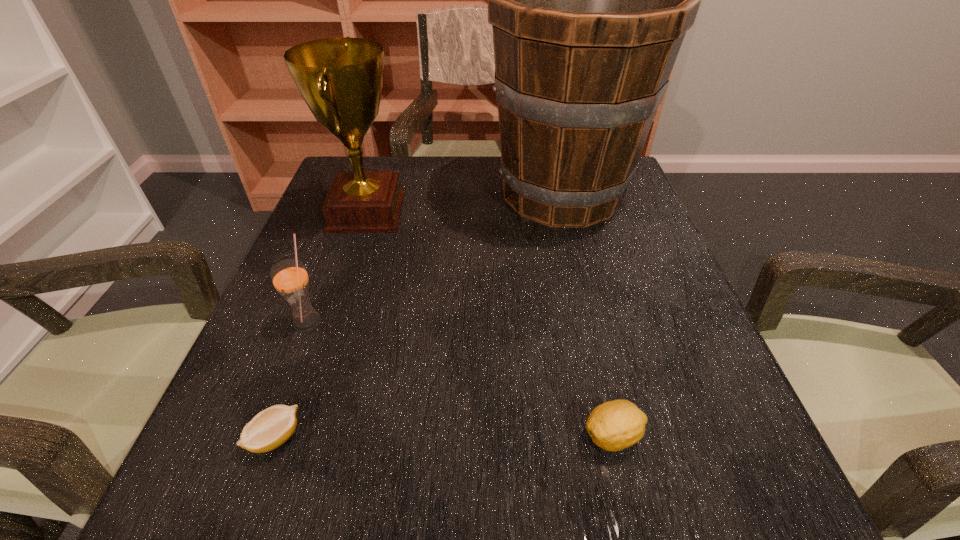
Locate an element on the screen. Image resolution: width=960 pixels, height=540 pixels. free space located 0.050m on the front of the third shortest object is located at coordinates (294, 357).

Find the location of a particular element. This screenshot has width=960, height=540. free location located at the stem end of the fourth tallest object is located at coordinates (323, 436).

The width and height of the screenshot is (960, 540). I want to click on vacant region located 0.200m at the stem end of the fourth tallest object, so click(x=442, y=436).

Find the location of a particular element. The width and height of the screenshot is (960, 540). vacant area located 0.300m at the stem end of the fourth tallest object is located at coordinates (372, 436).

Where is `vacant area situated on the back of the shorter lemon`? This screenshot has height=540, width=960. vacant area situated on the back of the shorter lemon is located at coordinates (323, 307).

Locate an element on the screen. bucket present at the far edge is located at coordinates (590, 0).

At what (x,y) coordinates should I click in order to perform the action: click on award present at the far edge. Please return your answer as a coordinate pair (x, y). The width and height of the screenshot is (960, 540). Looking at the image, I should click on (341, 79).

Identify the location of award that is at the left edge. (341, 79).

At what (x,y) coordinates should I click in order to perform the action: click on straw positioned at the left edge. Please return your answer as a coordinate pair (x, y). The height and width of the screenshot is (540, 960). Looking at the image, I should click on (289, 277).

Find the location of a particular element. lemon that is at the left edge is located at coordinates (269, 429).